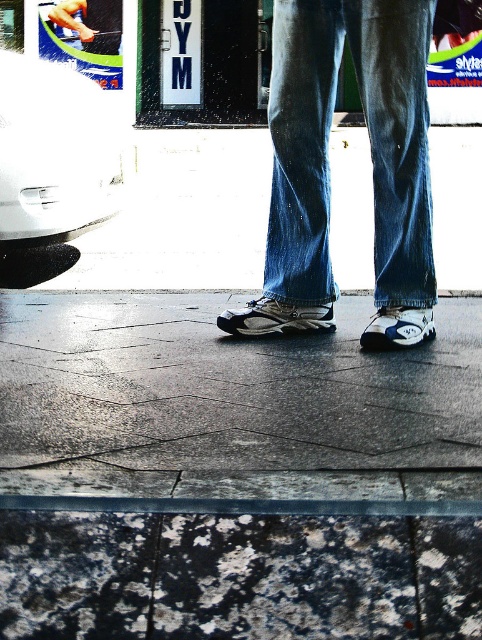
Question: Which of the following is the farthest from the observer?

Choices:
 (A) white glossy car at left
 (B) white mesh shoe at center
 (C) white synthetic sneaker at center

Answer: (A)

Question: Is white glossy car at left further to camera compared to white mesh shoe at center?

Choices:
 (A) yes
 (B) no

Answer: (A)

Question: Is the position of white glossy car at left less distant than that of white mesh shoe at center?

Choices:
 (A) no
 (B) yes

Answer: (A)

Question: Which object is the farthest from the white synthetic sneaker at center?

Choices:
 (A) white mesh shoe at center
 (B) blue denim jeans at center

Answer: (B)

Question: In this image, where is white mesh shoe at center located relative to white synthetic sneaker at center?

Choices:
 (A) right
 (B) left

Answer: (B)

Question: Among these points, which one is farthest from the camera?

Choices:
 (A) (249, 314)
 (B) (388, 340)
 (C) (296, 160)

Answer: (A)